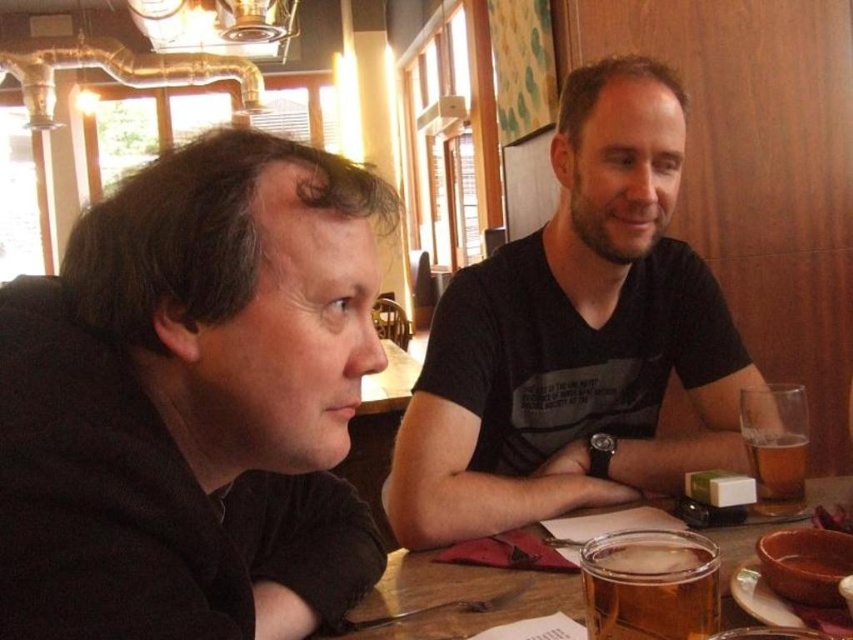
Which is more to the left, black matte shirt at center or clear glass mug at center?

Positioned to the left is clear glass mug at center.

Is point (589, 67) closer to camera compared to point (753, 540)?

No.

Does point (618, 204) come closer to viewer compared to point (346, 632)?

No, (618, 204) is behind (346, 632).

The image size is (853, 640). I want to click on black matte shirt at center, so point(573,337).

Which is behind, point (526, 612) or point (781, 464)?

Positioned behind is point (781, 464).

Does clear glass mug at center appear on the right side of translucent glass beer at right?

No, clear glass mug at center is not to the right of translucent glass beer at right.

Describe the element at coordinates (459, 596) in the screenshot. I see `clear glass mug at center` at that location.

You are a GUI agent. You are given a task and a screenshot of the screen. Output one action in this format:
    pyautogui.click(x=<x>, y=<y>)
    Task: Click on the clear glass mug at center
    Image resolution: width=853 pixels, height=640 pixels.
    Given the screenshot: What is the action you would take?
    pyautogui.click(x=459, y=596)

Which is below, black matte shirt at left or clear glass mug at center?

clear glass mug at center is below.

Identify the location of black matte shirt at left. (190, 400).